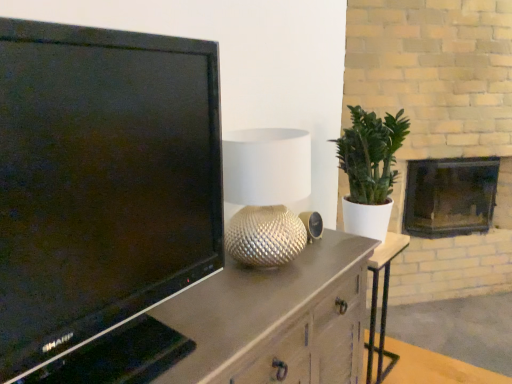
Find the location of a particular element. The width and height of the screenshot is (512, 384). free spot to the right of silver textured lamp at center is located at coordinates (330, 260).